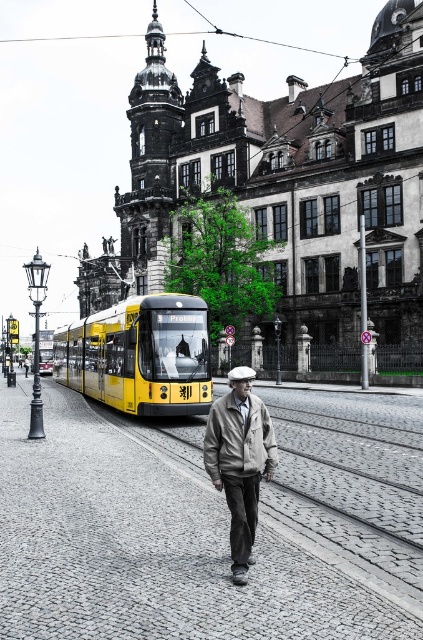
You are a pedestrian standing on the sidewalk. You see a yellow matte bus at center and a khaki fabric jacket at center. Which object is closer to you?

The khaki fabric jacket at center is closer to you because the yellow matte bus at center is positioned over it, indicating that the jacket is behind the bus.

You are a photographer standing on the sidewalk. You want to take a photo of the yellow matte bus at center and the khaki fabric jacket at center. Which object should you focus on first if you want to capture both in the same frame without moving your camera?

The yellow matte bus at center is much taller than the khaki fabric jacket at center, so you should focus on the yellow matte bus at center first to ensure its full height is captured in the frame.

You are a tourist standing on the sidewalk in front of the tram tracks. You see a yellow matte bus at center and a khaki fabric jacket at center. Which object is closer to the left side of the tram tracks?

The yellow matte bus at center is closer to the left side of the tram tracks because it is positioned to the left of the khaki fabric jacket at center.